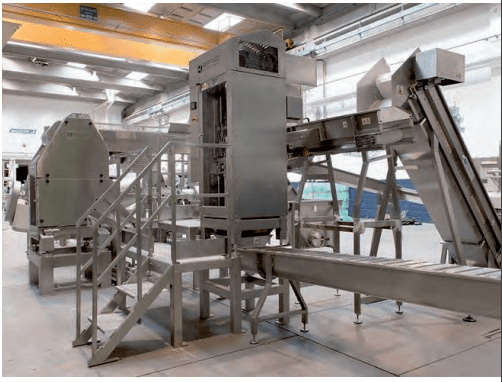
You are a GUI agent. You are given a task and a screenshot of the screen. Output one action in this format:
    pyautogui.click(x=<x>, y=<y>)
    Task: Click on the top corners of stair rails
    This screenshot has width=502, height=382.
    Given the screenshot: What is the action you would take?
    click(x=170, y=142), click(x=146, y=148)